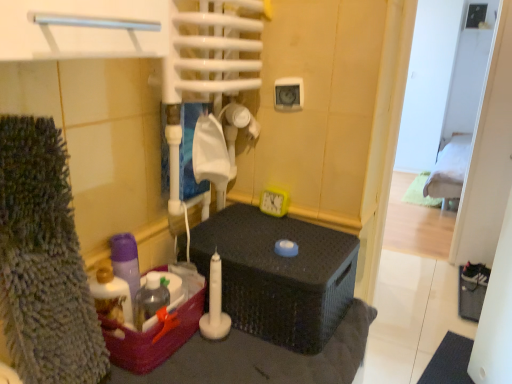
I want to click on free space in front of matte black wicker basket at center, so click(x=259, y=362).